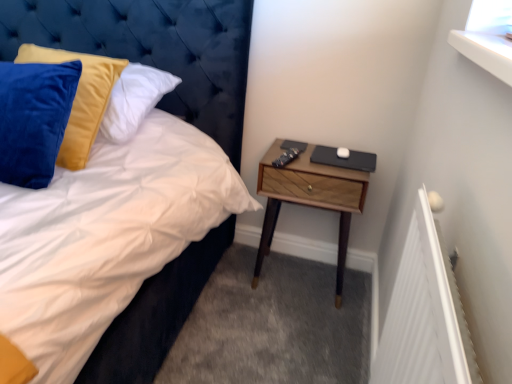
Measure the distance between wooden nightstand at right and camera.

wooden nightstand at right is 5.11 feet from camera.

Describe the element at coordinates (309, 198) in the screenshot. Image resolution: width=512 pixels, height=384 pixels. I see `wooden nightstand at right` at that location.

Find the location of a particular element. wooden nightstand at right is located at coordinates (309, 198).

The image size is (512, 384). Describe the element at coordinates (154, 49) in the screenshot. I see `velvet blue headboard at upper left` at that location.

The width and height of the screenshot is (512, 384). What are the coordinates of `velvet blue headboard at upper left` in the screenshot? It's located at (154, 49).

Locate an element on the screen. This screenshot has width=512, height=384. wooden nightstand at right is located at coordinates (309, 198).

In the image, is wooden nightstand at right on the left side or the right side of velvet blue headboard at upper left?

From the image, it's evident that wooden nightstand at right is to the right of velvet blue headboard at upper left.

Considering the positions of objects wooden nightstand at right and velvet blue headboard at upper left in the image provided, who is behind, wooden nightstand at right or velvet blue headboard at upper left?

wooden nightstand at right is further from the camera.

Between point (313, 180) and point (180, 74), which one is positioned behind?

Point (180, 74)

From the image's perspective, is wooden nightstand at right on top of velvet blue headboard at upper left?

No, from the image's perspective, wooden nightstand at right is not above velvet blue headboard at upper left.

From a real-world perspective, is wooden nightstand at right above or below velvet blue headboard at upper left?

From a real-world perspective, wooden nightstand at right is physically below velvet blue headboard at upper left.

Which of these two, wooden nightstand at right or velvet blue headboard at upper left, is wider?

velvet blue headboard at upper left is wider.

Can you confirm if wooden nightstand at right is shorter than velvet blue headboard at upper left?

Yes.

Consider the image. Which of these two, wooden nightstand at right or velvet blue headboard at upper left, is smaller?

wooden nightstand at right is smaller.

In the scene shown: Is velvet blue headboard at upper left a part of wooden nightstand at right?

No.

Is wooden nightstand at right placed right next to velvet blue headboard at upper left?

wooden nightstand at right is not next to velvet blue headboard at upper left, and they're not touching.

Is wooden nightstand at right aimed at velvet blue headboard at upper left?

No, wooden nightstand at right is not oriented towards velvet blue headboard at upper left.

What's the angular difference between wooden nightstand at right and velvet blue headboard at upper left's facing directions?

The angular difference between wooden nightstand at right and velvet blue headboard at upper left is 2.93 degrees.

Measure the distance between wooden nightstand at right and velvet blue headboard at upper left.

wooden nightstand at right is 56.44 centimeters away from velvet blue headboard at upper left.

Where is `nightstand behind the velvet blue headboard at upper left`? This screenshot has width=512, height=384. nightstand behind the velvet blue headboard at upper left is located at coordinates (309, 198).

Looking at this image, which object is positioned more to the left, velvet blue headboard at upper left or wooden nightstand at right?

velvet blue headboard at upper left is more to the left.

Is velvet blue headboard at upper left in front of or behind wooden nightstand at right in the image?

velvet blue headboard at upper left is in front of wooden nightstand at right.

Which is farther, [165,24] or [267,212]?

Point [267,212]

From the image's perspective, between velvet blue headboard at upper left and wooden nightstand at right, who is located below?

wooden nightstand at right appears lower in the image.

From a real-world perspective, between velvet blue headboard at upper left and wooden nightstand at right, who is vertically lower?

wooden nightstand at right is physically lower.

Does velvet blue headboard at upper left have a greater width compared to wooden nightstand at right?

Yes, velvet blue headboard at upper left is wider than wooden nightstand at right.

Between velvet blue headboard at upper left and wooden nightstand at right, which one has more height?

Standing taller between the two is velvet blue headboard at upper left.

Considering the sizes of objects velvet blue headboard at upper left and wooden nightstand at right in the image provided, who is smaller, velvet blue headboard at upper left or wooden nightstand at right?

With smaller size is wooden nightstand at right.

Is wooden nightstand at right a part of velvet blue headboard at upper left?

Actually, wooden nightstand at right is outside velvet blue headboard at upper left.

Are velvet blue headboard at upper left and wooden nightstand at right making contact?

No, velvet blue headboard at upper left is not in contact with wooden nightstand at right.

Could you tell me if velvet blue headboard at upper left is facing wooden nightstand at right?

No.

Can you tell me how much velvet blue headboard at upper left and wooden nightstand at right differ in facing direction?

2.93 degrees separate the facing orientations of velvet blue headboard at upper left and wooden nightstand at right.

Where is `nightstand below the velvet blue headboard at upper left (from the image's perspective)`? This screenshot has height=384, width=512. nightstand below the velvet blue headboard at upper left (from the image's perspective) is located at coordinates (309, 198).

Locate an element on the screen. The width and height of the screenshot is (512, 384). nightstand below the velvet blue headboard at upper left (from a real-world perspective) is located at coordinates (309, 198).

Where is `headboard that is on the left side of wooden nightstand at right`? headboard that is on the left side of wooden nightstand at right is located at coordinates (154, 49).